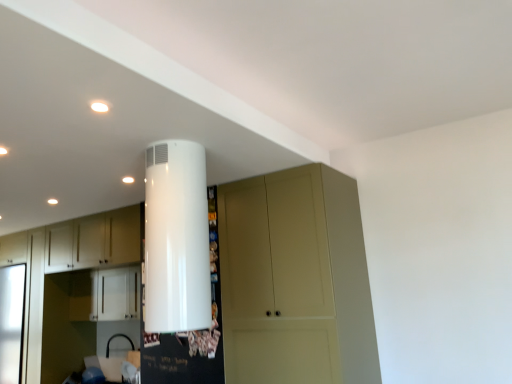
The height and width of the screenshot is (384, 512). What do you see at coordinates (68, 262) in the screenshot? I see `white matte cabinet at left, marked as the second cabinetry in a right-to-left arrangement` at bounding box center [68, 262].

What do you see at coordinates (176, 238) in the screenshot? I see `white glossy water heater at upper center` at bounding box center [176, 238].

The width and height of the screenshot is (512, 384). What are the coordinates of `white matte cabinet at left, the first cabinetry when ordered from left to right` in the screenshot? It's located at (68, 262).

Is white glossy cabinet at center, which is the 1th cabinetry in right-to-left order, next to white glossy water heater at upper center?

No, white glossy cabinet at center, which is the 1th cabinetry in right-to-left order, is not beside white glossy water heater at upper center.

Is white glossy water heater at upper center a part of white glossy cabinet at center, the 2th cabinetry viewed from the left?

Definitely not — white glossy water heater at upper center is not inside white glossy cabinet at center, the 2th cabinetry viewed from the left.

Between white glossy cabinet at center, the 2th cabinetry viewed from the left, and white glossy water heater at upper center, which one has less height?

Standing shorter between the two is white glossy cabinet at center, the 2th cabinetry viewed from the left.

How many degrees apart are the facing directions of white glossy cabinet at center, the 2th cabinetry viewed from the left, and white glossy water heater at upper center?

white glossy cabinet at center, the 2th cabinetry viewed from the left, and white glossy water heater at upper center are facing 90 degrees away from each other.

Between point (38, 361) and point (125, 286), which one is positioned behind?

The point (38, 361) is behind.

Does white matte cabinet at left, the first cabinetry when ordered from left to right, lie behind white glossy cabinet at center, the 2th cabinetry viewed from the left?

Yes, it is behind white glossy cabinet at center, the 2th cabinetry viewed from the left.

I want to click on cabinetry lying behind the white glossy cabinet at center, the 2th cabinetry viewed from the left, so click(68, 262).

From the image's perspective, is white matte cabinet at left, the first cabinetry when ordered from left to right, located beneath white glossy cabinet at center, the 2th cabinetry viewed from the left?

Indeed, from the image's perspective, white matte cabinet at left, the first cabinetry when ordered from left to right, is shown beneath white glossy cabinet at center, the 2th cabinetry viewed from the left.

Is there a large distance between white matte cabinet at left, marked as the second cabinetry in a right-to-left arrangement, and white glossy water heater at upper center?

Indeed, white matte cabinet at left, marked as the second cabinetry in a right-to-left arrangement, is not near white glossy water heater at upper center.

Between white matte cabinet at left, the first cabinetry when ordered from left to right, and white glossy water heater at upper center, which one has smaller size?

white glossy water heater at upper center.

Locate an element on the screen. The width and height of the screenshot is (512, 384). water heater lying above the white matte cabinet at left, marked as the second cabinetry in a right-to-left arrangement (from the image's perspective) is located at coordinates (176, 238).

Which object is further away from the camera taking this photo, white matte cabinet at left, marked as the second cabinetry in a right-to-left arrangement, or white glossy water heater at upper center?

white matte cabinet at left, marked as the second cabinetry in a right-to-left arrangement, is further from the camera.

Considering the positions of points (295, 319) and (78, 273), is point (295, 319) closer to camera compared to point (78, 273)?

Yes.

Is white glossy cabinet at center, which is the 1th cabinetry in right-to-left order, located within matte beige cupboard at center?

No, white glossy cabinet at center, which is the 1th cabinetry in right-to-left order, is located outside of matte beige cupboard at center.

The height and width of the screenshot is (384, 512). I want to click on cupboard on the right of white glossy cabinet at center, which is the 1th cabinetry in right-to-left order, so click(296, 280).

Which of these two, matte beige cupboard at center or white glossy cabinet at center, which is the 1th cabinetry in right-to-left order, is wider?

matte beige cupboard at center is wider.

Find the location of `cabinetry that is the 2nd object directly below the white glossy water heater at upper center (from a real-world perspective)`. cabinetry that is the 2nd object directly below the white glossy water heater at upper center (from a real-world perspective) is located at coordinates (68, 262).

Is white glossy water heater at upper center shorter than white matte cabinet at left, the first cabinetry when ordered from left to right?

Yes.

Which is nearer, (267, 206) or (129, 233)?

The point (267, 206) is closer to the camera.

From a real-world perspective, is matte beige cupboard at center positioned over white matte cabinet at left, the first cabinetry when ordered from left to right, based on gravity?

Yes, from a real-world perspective, matte beige cupboard at center is on top of white matte cabinet at left, the first cabinetry when ordered from left to right.

Considering the sizes of matte beige cupboard at center and white matte cabinet at left, marked as the second cabinetry in a right-to-left arrangement, in the image, is matte beige cupboard at center wider or thinner than white matte cabinet at left, marked as the second cabinetry in a right-to-left arrangement,?

matte beige cupboard at center is wider than white matte cabinet at left, marked as the second cabinetry in a right-to-left arrangement.

Is matte beige cupboard at center taller than white matte cabinet at left, the first cabinetry when ordered from left to right?

No.

Is white glossy water heater at upper center inside the boundaries of white glossy cabinet at center, the 2th cabinetry viewed from the left, or outside?

white glossy water heater at upper center is located beyond the bounds of white glossy cabinet at center, the 2th cabinetry viewed from the left.

How far apart are white glossy water heater at upper center and white glossy cabinet at center, which is the 1th cabinetry in right-to-left order?

A distance of 5.90 feet exists between white glossy water heater at upper center and white glossy cabinet at center, which is the 1th cabinetry in right-to-left order.

The height and width of the screenshot is (384, 512). In order to click on water heater that is above the white glossy cabinet at center, the 2th cabinetry viewed from the left (from a real-world perspective) in this screenshot , I will do `click(176, 238)`.

How many degrees apart are the facing directions of white glossy water heater at upper center and white glossy cabinet at center, the 2th cabinetry viewed from the left?

The angular difference between white glossy water heater at upper center and white glossy cabinet at center, the 2th cabinetry viewed from the left, is 90 degrees.

Locate an element on the screen. the 1st cabinetry positioned below the white glossy water heater at upper center (from a real-world perspective) is located at coordinates (105, 294).

Where is `cabinetry on the right of the white matte cabinet at left, marked as the second cabinetry in a right-to-left arrangement`? cabinetry on the right of the white matte cabinet at left, marked as the second cabinetry in a right-to-left arrangement is located at coordinates (105, 294).

Looking at the image, which one is located closer to white glossy water heater at upper center, white matte cabinet at left, marked as the second cabinetry in a right-to-left arrangement, or matte beige cupboard at center?

matte beige cupboard at center is closer to white glossy water heater at upper center.

From the image, which object appears to be farther from white glossy cabinet at center, the 2th cabinetry viewed from the left, white matte cabinet at left, the first cabinetry when ordered from left to right, or white glossy water heater at upper center?

Among the two, white glossy water heater at upper center is located further to white glossy cabinet at center, the 2th cabinetry viewed from the left.

Which object lies further to the anchor point white glossy cabinet at center, which is the 1th cabinetry in right-to-left order, white glossy water heater at upper center or white matte cabinet at left, the first cabinetry when ordered from left to right?

white glossy water heater at upper center.

Looking at the image, which one is located closer to white glossy cabinet at center, which is the 1th cabinetry in right-to-left order, white glossy water heater at upper center or matte beige cupboard at center?

matte beige cupboard at center.

Estimate the real-world distances between objects in this image. Which object is closer to matte beige cupboard at center, white matte cabinet at left, marked as the second cabinetry in a right-to-left arrangement, or white glossy cabinet at center, the 2th cabinetry viewed from the left?

Based on the image, white matte cabinet at left, marked as the second cabinetry in a right-to-left arrangement, appears to be nearer to matte beige cupboard at center.

Looking at the image, which one is located further to white glossy cabinet at center, the 2th cabinetry viewed from the left, matte beige cupboard at center or white glossy water heater at upper center?

white glossy water heater at upper center.

Based on their spatial positions, is white glossy cabinet at center, the 2th cabinetry viewed from the left, or white matte cabinet at left, marked as the second cabinetry in a right-to-left arrangement, further from matte beige cupboard at center?

white glossy cabinet at center, the 2th cabinetry viewed from the left, is further to matte beige cupboard at center.

From the image, which object appears to be nearer to white glossy water heater at upper center, white glossy cabinet at center, which is the 1th cabinetry in right-to-left order, or matte beige cupboard at center?

matte beige cupboard at center.

In order to click on cabinetry located between white matte cabinet at left, the first cabinetry when ordered from left to right, and matte beige cupboard at center in the left-right direction in this screenshot , I will do `click(105, 294)`.

I want to click on cupboard between white glossy water heater at upper center and white glossy cabinet at center, which is the 1th cabinetry in right-to-left order, from front to back, so click(x=296, y=280).

The image size is (512, 384). I want to click on water heater situated between white matte cabinet at left, marked as the second cabinetry in a right-to-left arrangement, and matte beige cupboard at center from left to right, so click(x=176, y=238).

Where is `cabinetry located between white glossy water heater at upper center and white matte cabinet at left, the first cabinetry when ordered from left to right, in the depth direction`? cabinetry located between white glossy water heater at upper center and white matte cabinet at left, the first cabinetry when ordered from left to right, in the depth direction is located at coordinates (105, 294).